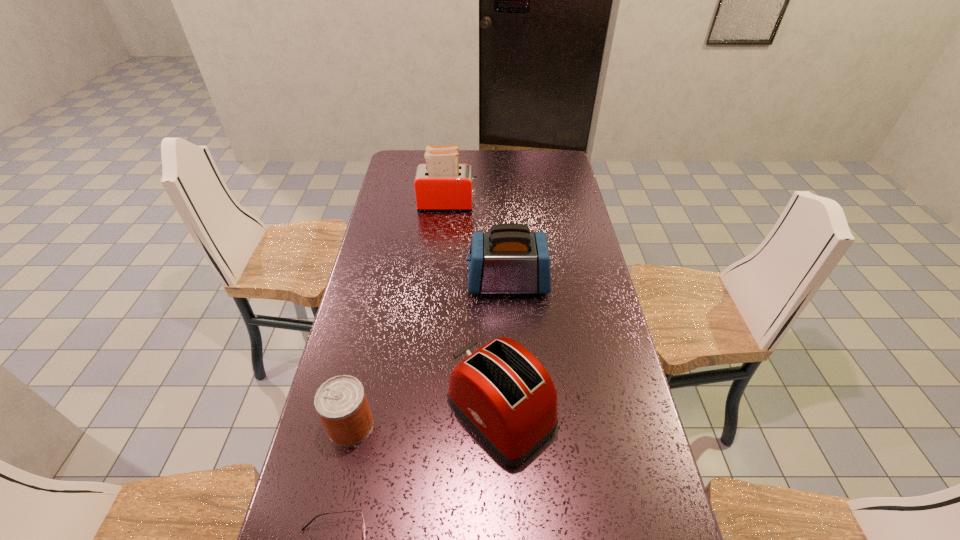
The height and width of the screenshot is (540, 960). What are the coordinates of `toaster that is at the left edge` in the screenshot? It's located at (442, 184).

What are the coordinates of `can at the left edge` in the screenshot? It's located at (341, 402).

Where is `free spot at the far edge of the desktop`? The width and height of the screenshot is (960, 540). free spot at the far edge of the desktop is located at coordinates (480, 160).

In the image, there is a desktop. Identify the location of vacant space at the left edge. The width and height of the screenshot is (960, 540). (398, 274).

At what (x,y) coordinates should I click in order to perform the action: click on vacant area at the right edge of the desktop. Please return your answer as a coordinate pair (x, y). The height and width of the screenshot is (540, 960). Looking at the image, I should click on (549, 246).

You are a GUI agent. You are given a task and a screenshot of the screen. Output one action in this format:
    pyautogui.click(x=<x>, y=<y>)
    Task: Click on the vacant space at the far left corner
    
    Given the screenshot: What is the action you would take?
    pyautogui.click(x=415, y=164)

Find the location of `vacant region at the far right corner of the desktop`. vacant region at the far right corner of the desktop is located at coordinates pos(554,171).

The image size is (960, 540). What are the coordinates of `vacant space that is in between the farthest toaster and the can` in the screenshot? It's located at (399, 314).

The image size is (960, 540). In order to click on free area in between the nearest toaster and the fourth tallest object in this screenshot , I will do `click(426, 419)`.

Where is `blank region between the can and the farthest toaster`? The image size is (960, 540). blank region between the can and the farthest toaster is located at coordinates (399, 314).